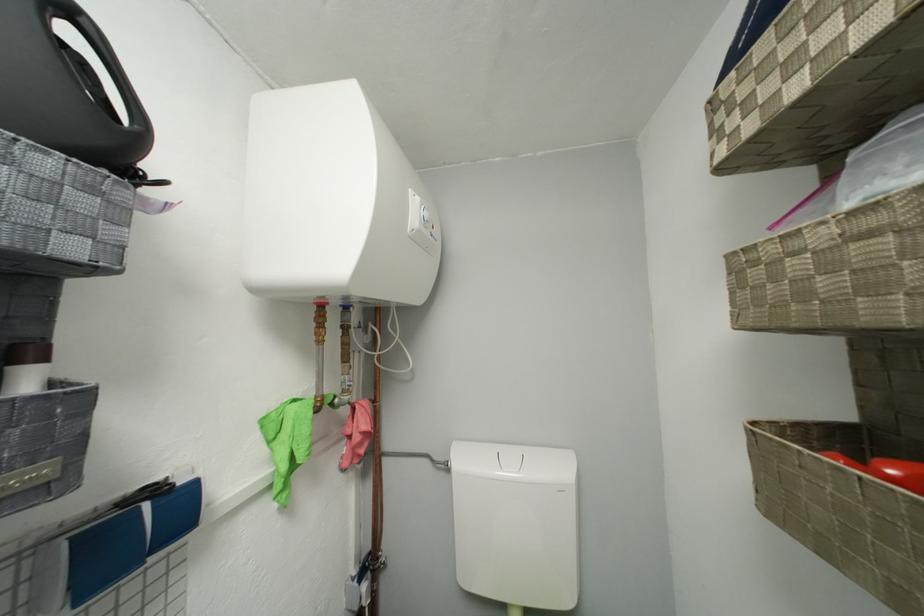
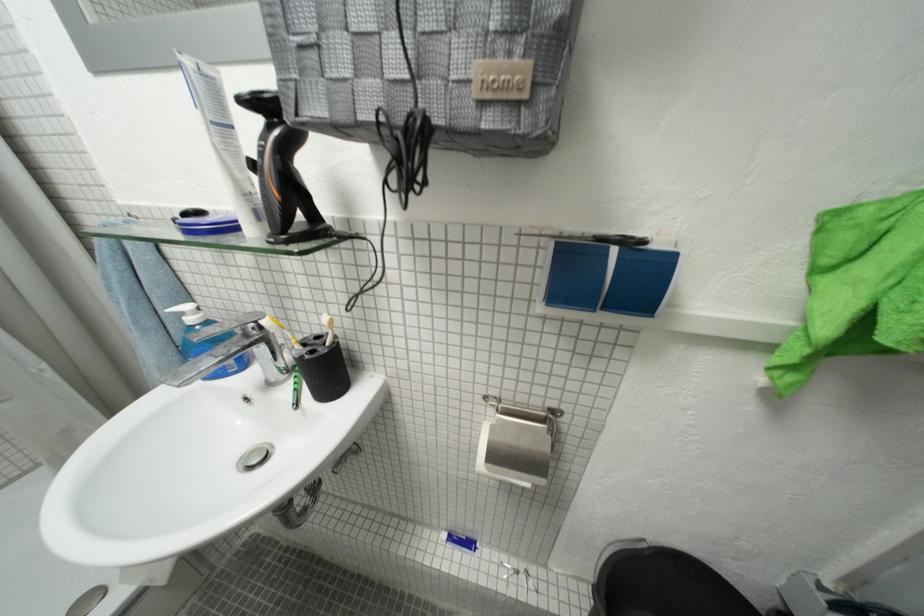
Where in the second image is the point corresponding to the point at 66,477 from the first image?

(535, 98)